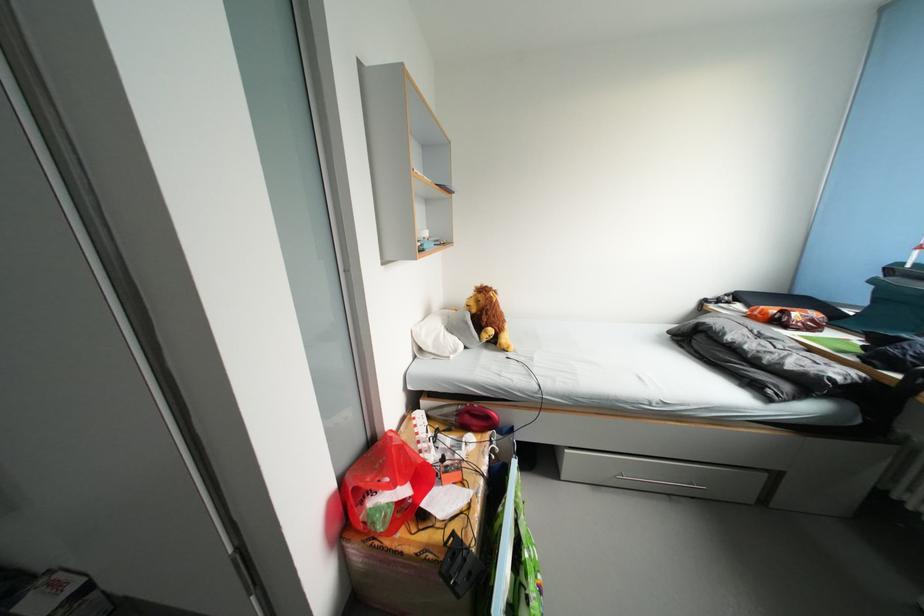
The image size is (924, 616). Describe the element at coordinates (458, 562) in the screenshot. I see `a power strip switch` at that location.